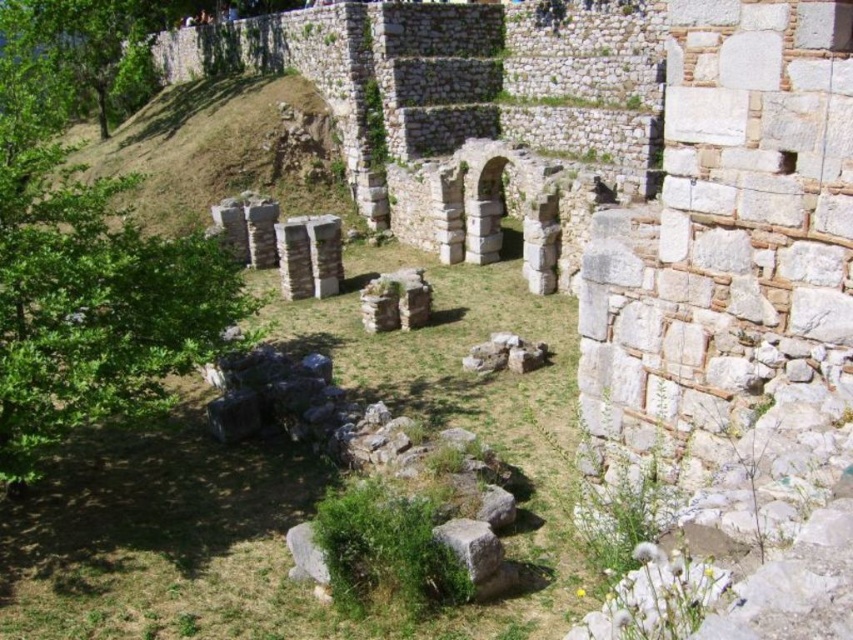
Question: Which of the following is the closest to the observer?

Choices:
 (A) green leafy tree at left
 (B) green grass at center

Answer: (B)

Question: Which of the following is the closest to the observer?

Choices:
 (A) (102, 237)
 (B) (492, 563)
 (C) (409, 403)

Answer: (B)

Question: Does green leafy tree at left appear on the right side of green mossy rock at center?

Choices:
 (A) no
 (B) yes

Answer: (A)

Question: Is green grass at center positioned at the back of green mossy rock at center?

Choices:
 (A) yes
 (B) no

Answer: (B)

Question: Is green leafy tree at left bigger than green mossy rock at center?

Choices:
 (A) yes
 (B) no

Answer: (A)

Question: Which of these objects is positioned farthest from the green grass at center?

Choices:
 (A) green mossy rock at center
 (B) green leafy tree at left

Answer: (B)